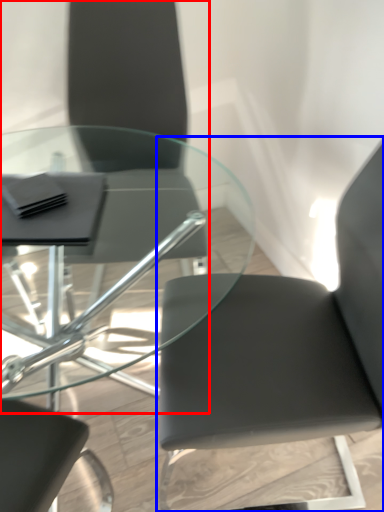
Question: Among these objects, which one is farthest to the camera, chair (highlighted by a red box) or chair (highlighted by a blue box)?

Choices:
 (A) chair
 (B) chair

Answer: (A)